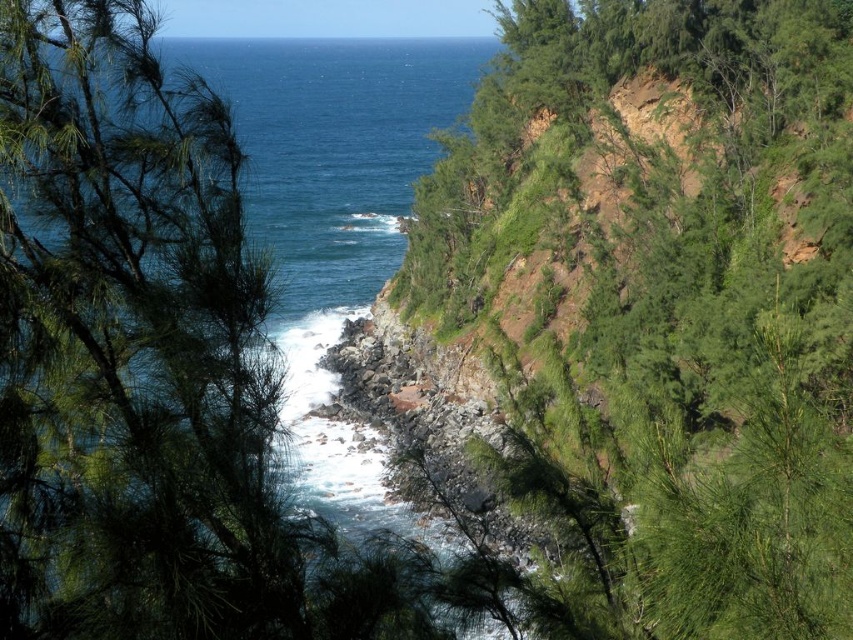
Question: Which object is closer to the camera taking this photo?

Choices:
 (A) blue water at center
 (B) green leafy tree at upper right

Answer: (B)

Question: Which of the following is the farthest from the observer?

Choices:
 (A) (677, 33)
 (B) (318, 284)

Answer: (B)

Question: Is green leafy tree at upper right further to the viewer compared to blue water at center?

Choices:
 (A) no
 (B) yes

Answer: (A)

Question: Where is green leafy tree at upper right located in relation to blue water at center in the image?

Choices:
 (A) left
 (B) right

Answer: (B)

Question: Does green leafy tree at upper right have a greater width compared to blue water at center?

Choices:
 (A) yes
 (B) no

Answer: (B)